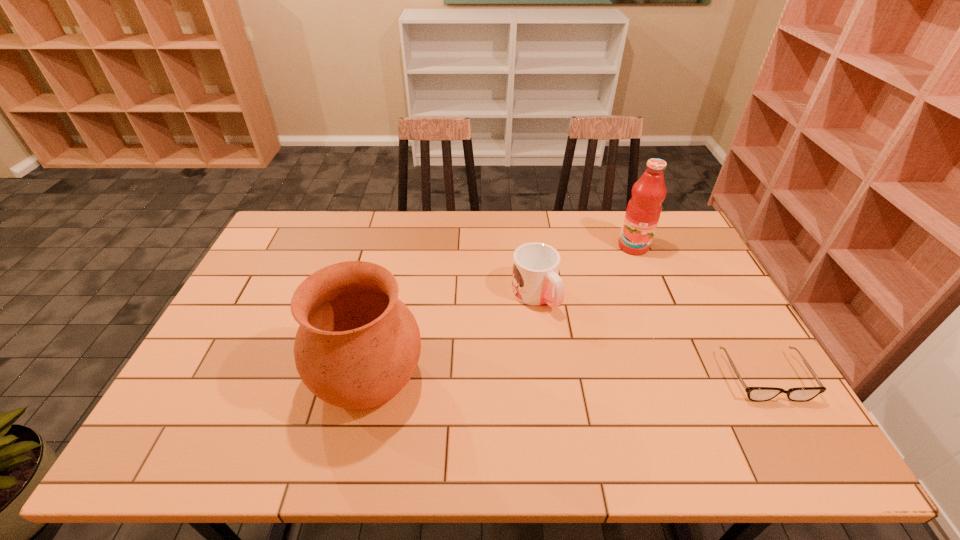
Locate an element on the screen. The image size is (960, 540). object located at the near right corner is located at coordinates (758, 394).

This screenshot has width=960, height=540. In the image, there is a desktop. Find the location of `free region at the far edge`. free region at the far edge is located at coordinates pos(490,214).

You are a GUI agent. You are given a task and a screenshot of the screen. Output one action in this format:
    pyautogui.click(x=<x>, y=<y>)
    Task: Click on the vacant space at the near edge of the desktop
    The width and height of the screenshot is (960, 540).
    Given the screenshot: What is the action you would take?
    pyautogui.click(x=682, y=416)

Locate an element on the screen. This screenshot has height=540, width=960. vacant space at the left edge of the desktop is located at coordinates (205, 350).

Where is `free space at the far left corner of the desktop`? free space at the far left corner of the desktop is located at coordinates (280, 240).

This screenshot has width=960, height=540. I want to click on vacant space at the far right corner of the desktop, so click(686, 238).

The image size is (960, 540). I want to click on unoccupied position between the third tallest object and the fruit juice, so click(584, 271).

This screenshot has height=540, width=960. I want to click on free space between the fruit juice and the third nearest object, so click(x=584, y=271).

This screenshot has height=540, width=960. I want to click on free space between the farthest object and the second farthest object, so click(x=584, y=271).

Where is `free space between the third nearest object and the spectacles`? The width and height of the screenshot is (960, 540). free space between the third nearest object and the spectacles is located at coordinates (650, 336).